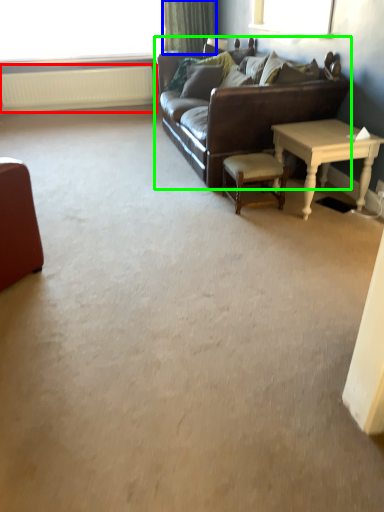
Question: Considering the real-world distances, which object is closest to radiator (highlighted by a red box)? curtain (highlighted by a blue box) or studio couch (highlighted by a green box).

Choices:
 (A) curtain
 (B) studio couch

Answer: (A)